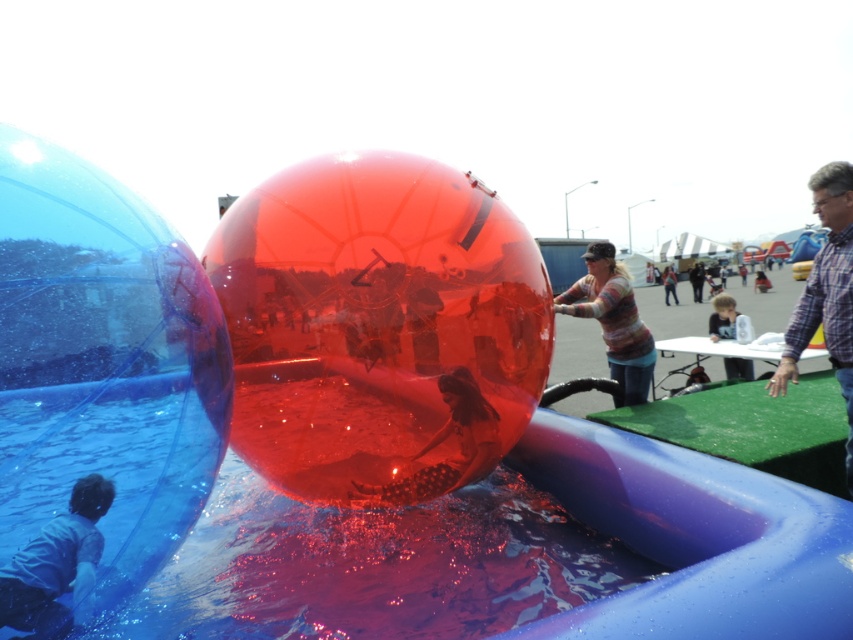
You are a photographer trying to capture the smooth skin child at center and the denim jacket at center in the same frame. Based on their positions, which object should you adjust your camera to focus on first to ensure both are in the shot?

The smooth skin child at center is positioned on the left side of denim jacket at center, so you should focus on the denim jacket at center first to ensure both objects are captured in the frame.

You are a photographer taking a picture of the plaid shirt at right and the smooth skin child at center. Based on their positions, which object should you focus on first to ensure both are in the frame?

The plaid shirt at right is below the smooth skin child at center, so you should focus on the smooth skin child at center first to ensure both are in the frame.